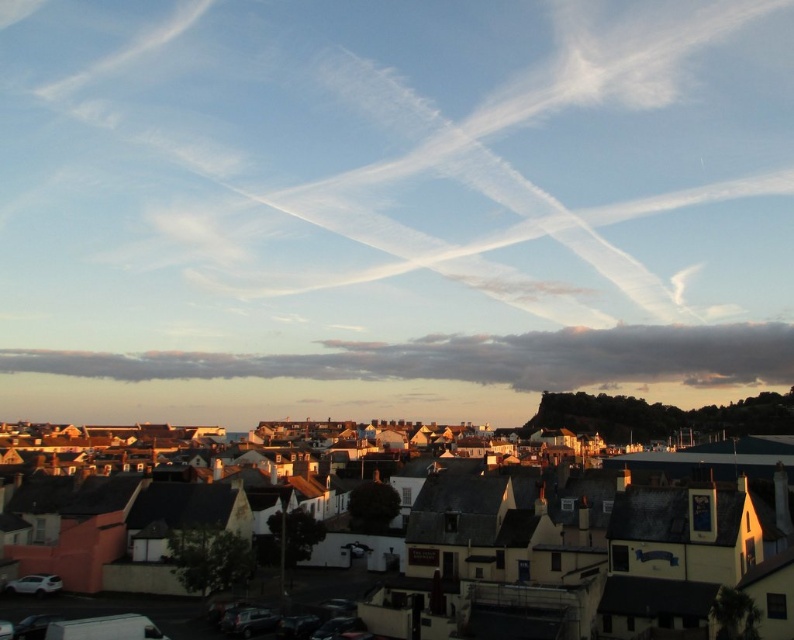
Question: Which point appears closest to the camera in this image?

Choices:
 (A) (634, 520)
 (B) (41, 349)

Answer: (A)

Question: Estimate the real-world distances between objects in this image. Which object is farther from the white wispy clouds at upper center?

Choices:
 (A) cloudy sky at lower center
 (B) matte yellow building at center

Answer: (B)

Question: Is white wispy clouds at upper center further to camera compared to cloudy sky at lower center?

Choices:
 (A) yes
 (B) no

Answer: (B)

Question: Which object is closer to the camera taking this photo?

Choices:
 (A) cloudy sky at lower center
 (B) matte yellow building at center

Answer: (B)

Question: Can you confirm if white wispy clouds at upper center is positioned to the right of cloudy sky at lower center?

Choices:
 (A) yes
 (B) no

Answer: (A)

Question: Can you confirm if matte yellow building at center is bigger than cloudy sky at lower center?

Choices:
 (A) no
 (B) yes

Answer: (A)